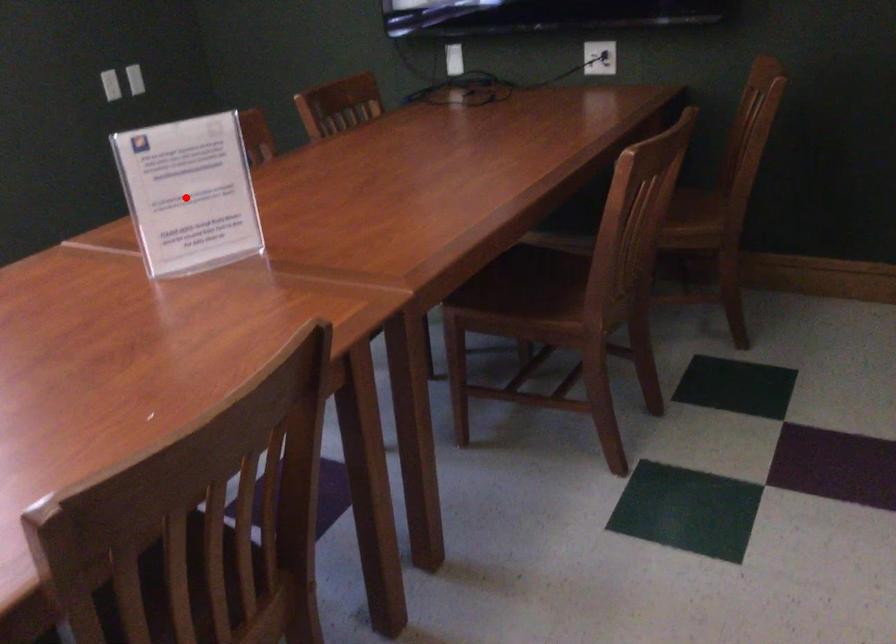
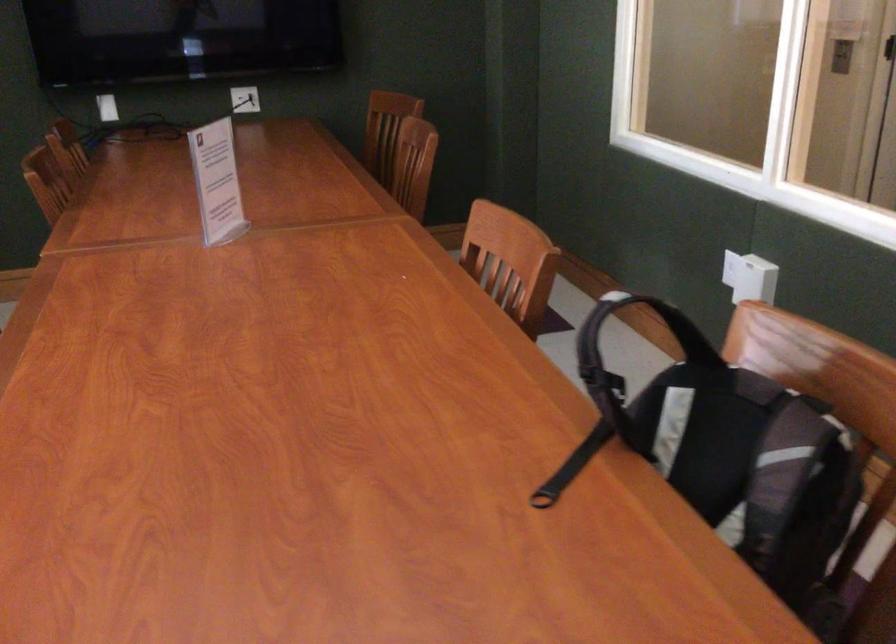
Find the pixel in the second image that matches the highlighted location in the first image.

(217, 182)